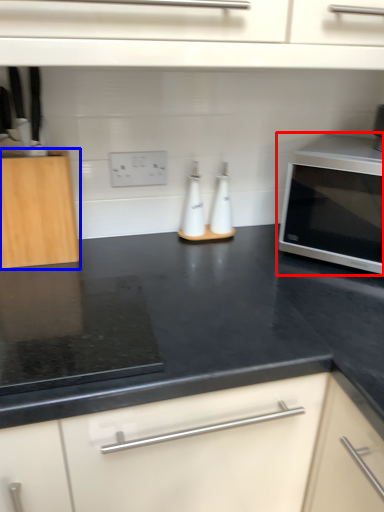
Question: Which object is further to the camera taking this photo, microwave oven (highlighted by a red box) or cabinetry (highlighted by a blue box)?

Choices:
 (A) microwave oven
 (B) cabinetry

Answer: (A)